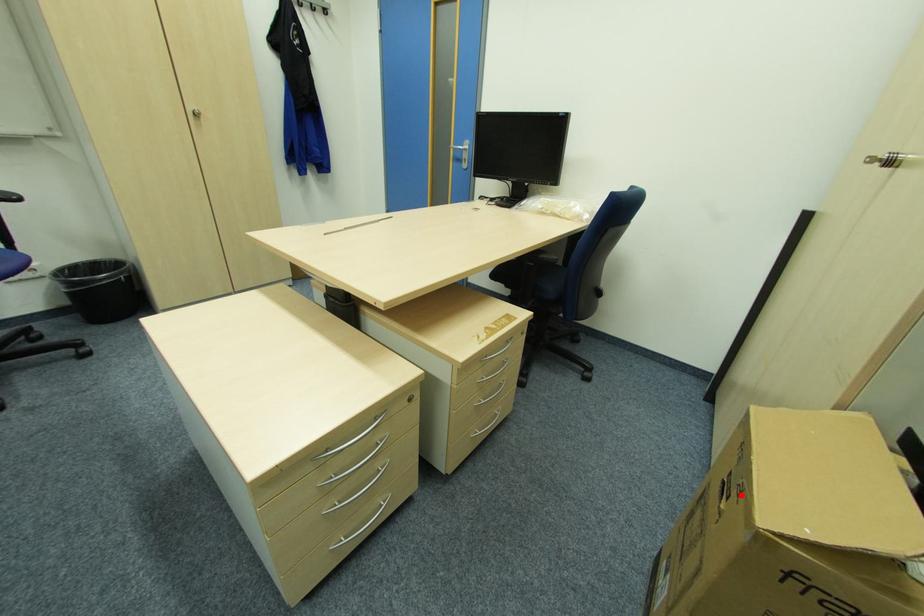
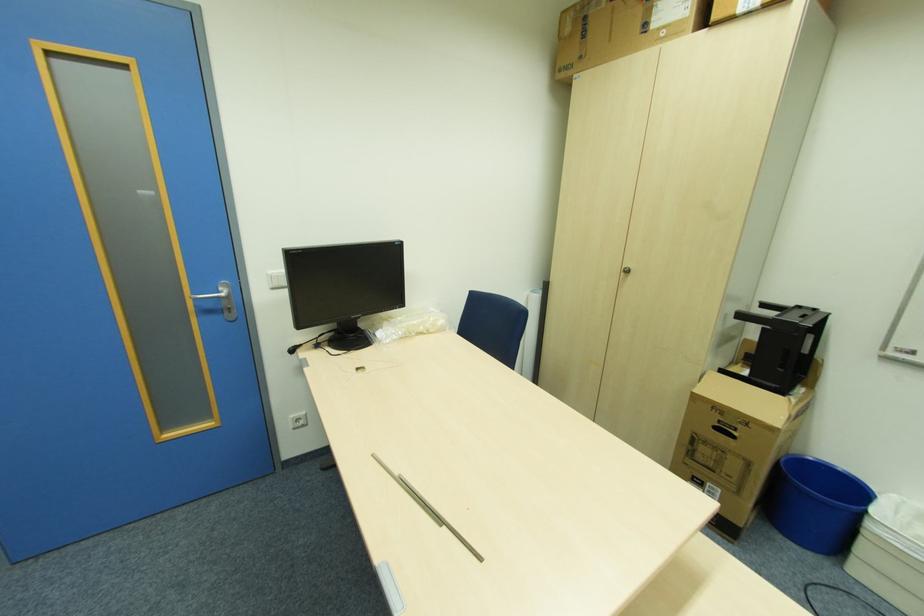
In the second image, find the point that corresponds to the highlighted location in the first image.

(748, 424)